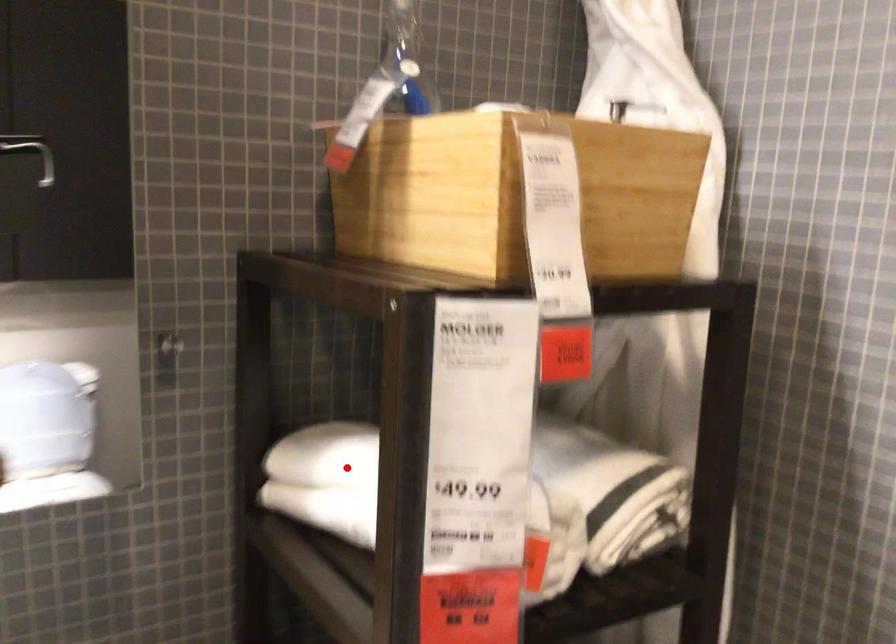
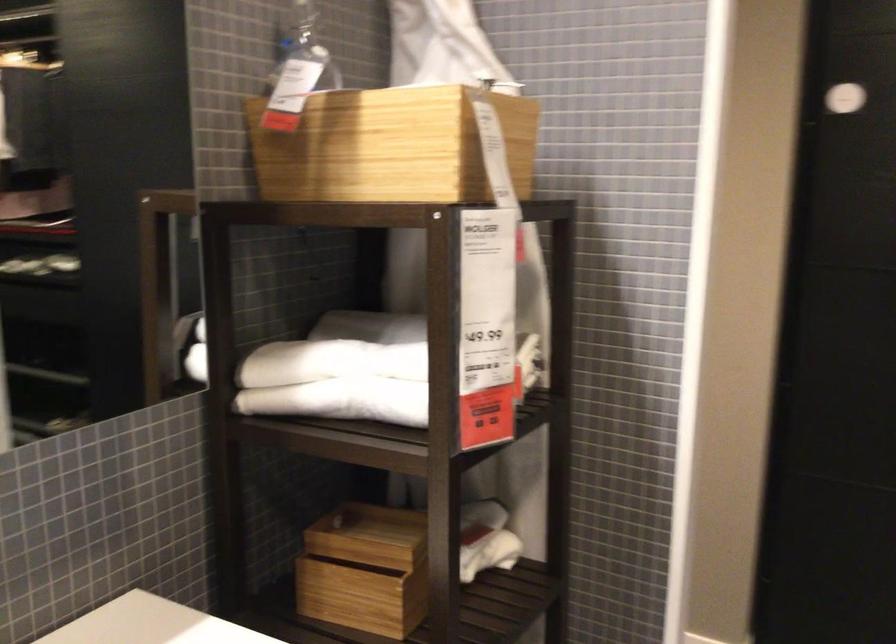
Question: I am providing you with two images of the same scene from different viewpoints. Given a red point in image1, look at the same physical point in image2. Is it:

Choices:
 (A) Closer to the viewpoint
 (B) Farther from the viewpoint

Answer: (B)